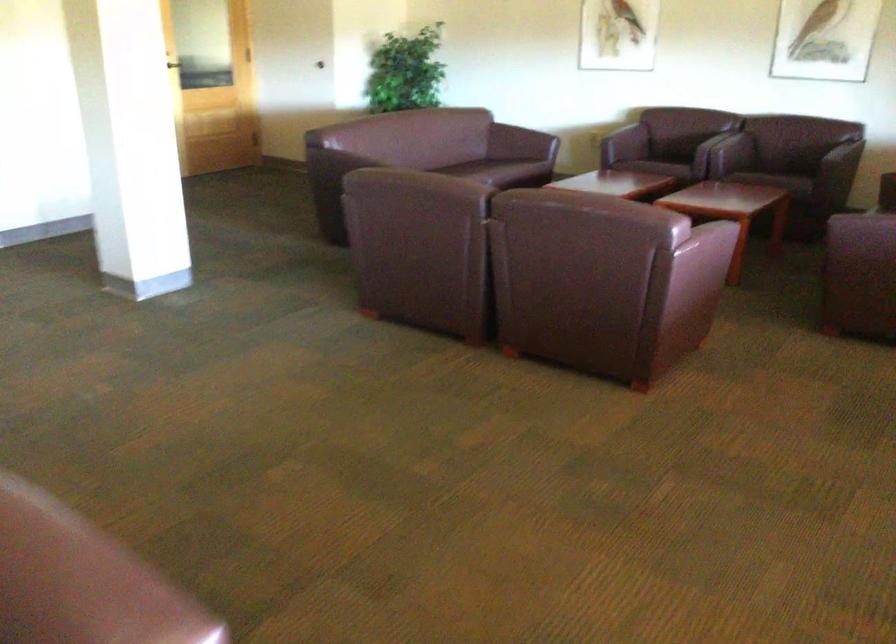
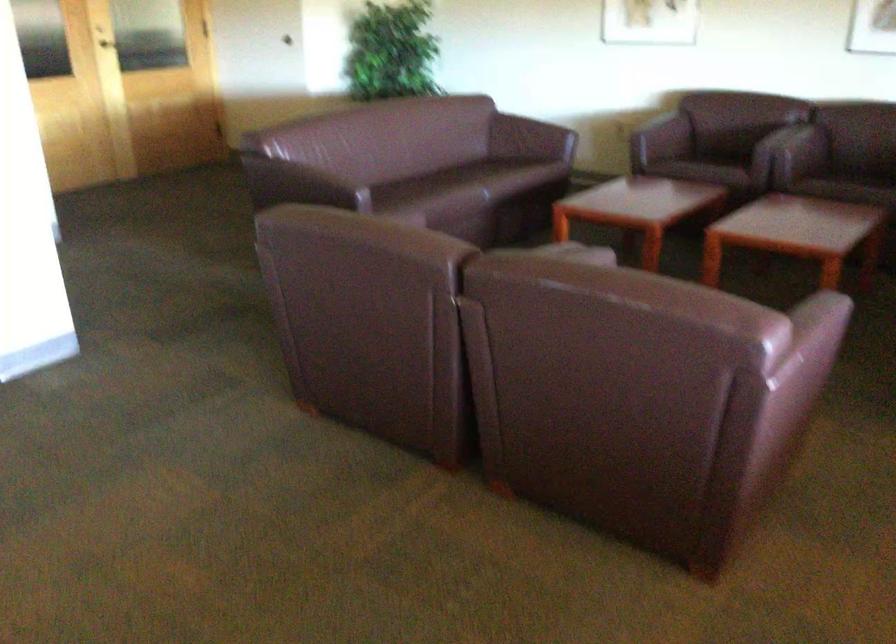
Question: What movement of the cameraman would produce the second image?

Choices:
 (A) Left
 (B) Right
 (C) Forward
 (D) Backward

Answer: (C)